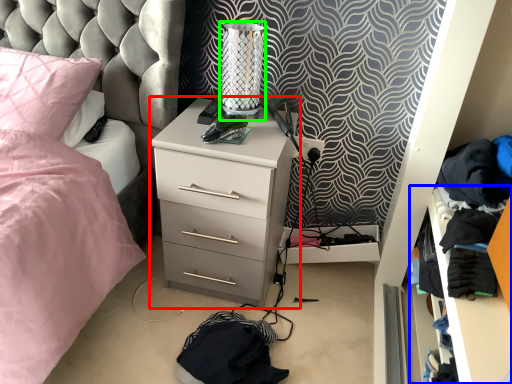
Question: Which object is the farthest from chest of drawers (highlighted by a red box)? Choose among these: shelf (highlighted by a blue box) or table lamp (highlighted by a green box).

Choices:
 (A) shelf
 (B) table lamp

Answer: (A)